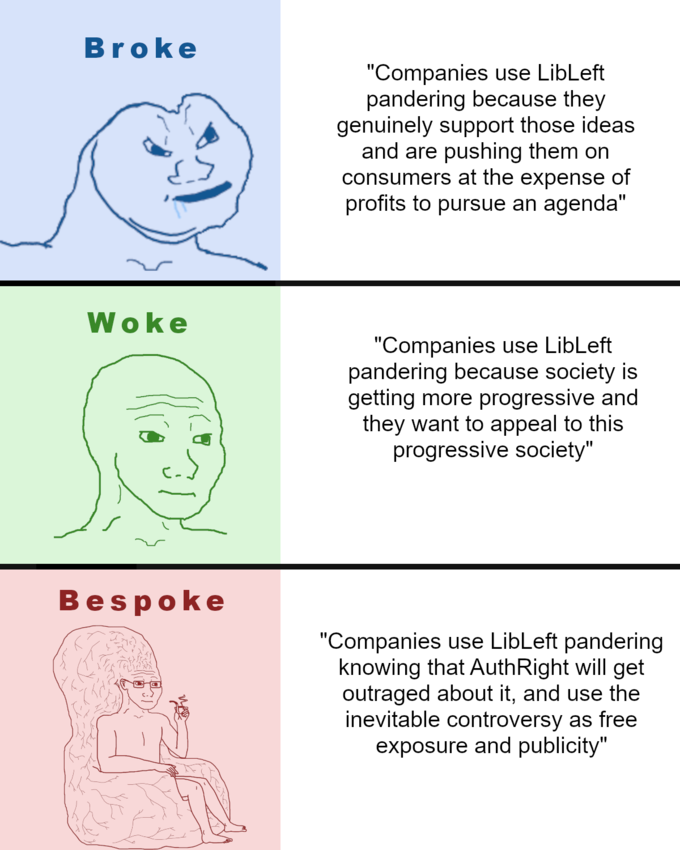
The width and height of the screenshot is (680, 850). I want to click on chair, so click(x=116, y=791).